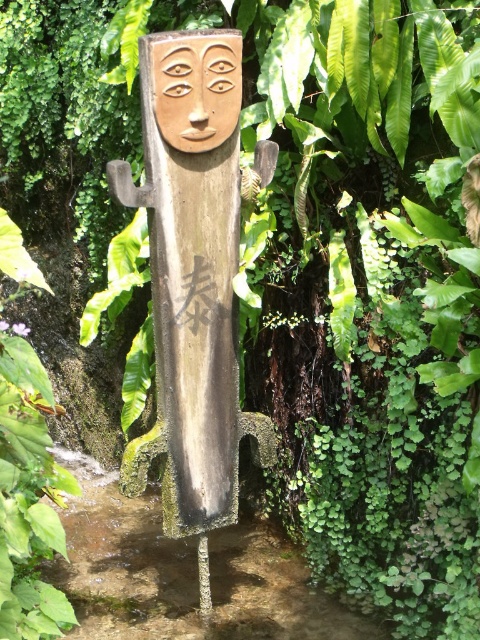
Question: Among these objects, which one is nearest to the camera?

Choices:
 (A) matte wood mask at upper center
 (B) wooden carving at center

Answer: (A)

Question: Does wooden carving at center have a lesser width compared to matte wood mask at upper center?

Choices:
 (A) no
 (B) yes

Answer: (A)

Question: Is wooden carving at center behind matte wood mask at upper center?

Choices:
 (A) no
 (B) yes

Answer: (B)

Question: Is wooden carving at center wider than matte wood mask at upper center?

Choices:
 (A) no
 (B) yes

Answer: (B)